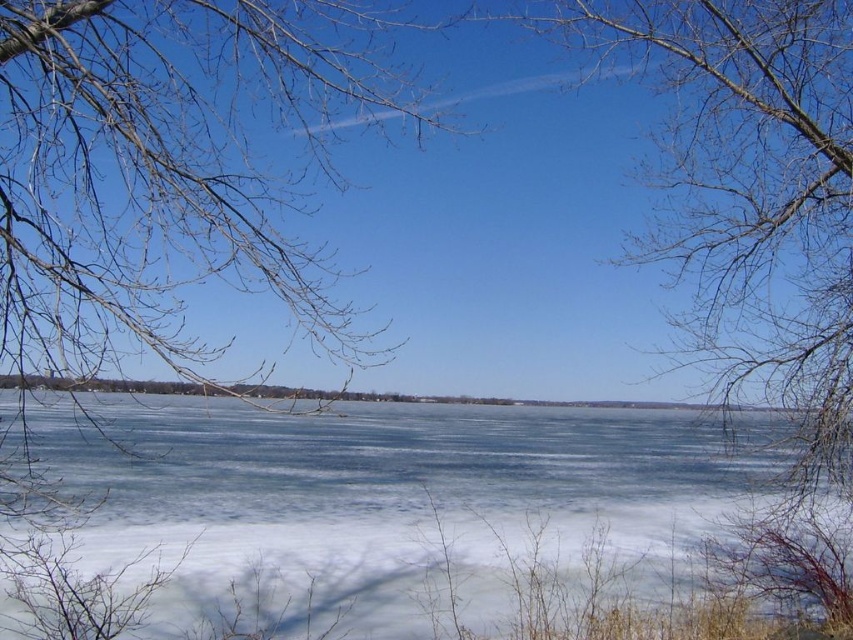
You are a drone operator trying to land a drone on the white ice at center. The drone has a GPS coordinate system where the bottom left corner of the image is the origin point. The coordinates are given as a percentage of the image width and height. What are the coordinates where you should aim to land the drone?

The white ice at center is located at coordinates 0.775 in the x axis and 0.472 in the y axis, so you should aim for those coordinates to land the drone.

You are an ice skater planning to glide across the frozen lake in the image. You notice the white ice at center and the bare branches at upper left. Which object is closer to the ground?

The white ice at center is shorter than the bare branches at upper left, so the white ice at center is closer to the ground.